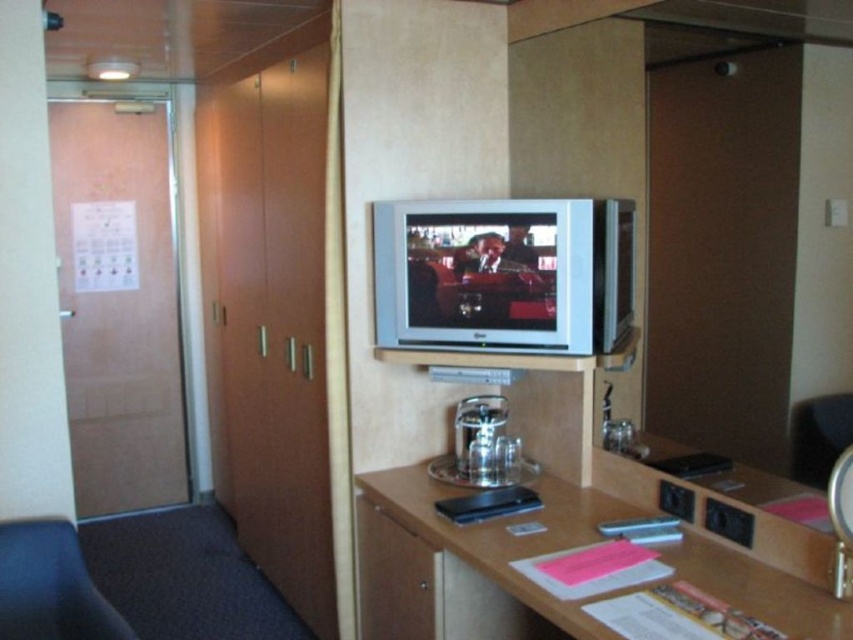
You are standing at the camera position in the cruise ship cabin. There is a point marked at coordinates (421,476). Can you reach this point without moving your position? Please explain why or why not.

The point at (421,476) is 7.73 feet away from the camera position. Since you are standing at the camera position, you cannot reach the point without moving because it is too far away.

You are a passenger in a cruise ship cabin and want to watch a movie on the silver metallic flat screen tv at center. You are currently sitting in the black leather swivel chair at lower left. Can you comfortably reach the remote control placed on the small shelf below the TV from your seat?

The distance between the silver metallic flat screen tv at center and the black leather swivel chair at lower left is 3.66 feet. Since the remote control is on the shelf below the TV, you can comfortably reach it from the chair as the distance is within a typical comfortable reach range.